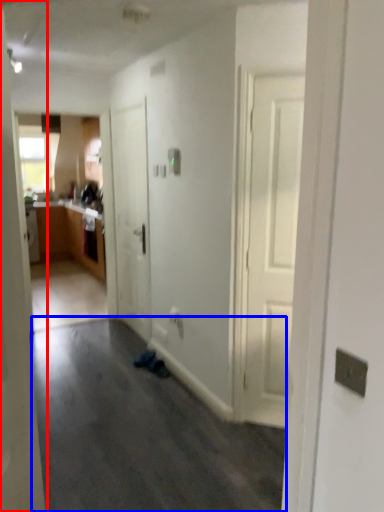
Question: Among these objects, which one is nearest to the camera, door (highlighted by a red box) or plain (highlighted by a blue box)?

Choices:
 (A) door
 (B) plain

Answer: (A)